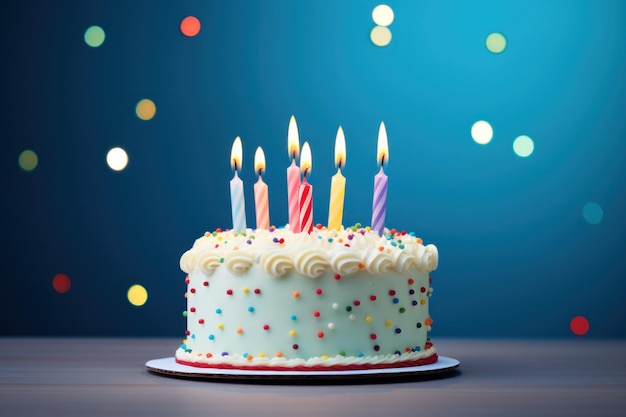
Identify the location of candles. The image size is (626, 417). (239, 197), (249, 199), (295, 193), (305, 197), (337, 197), (386, 187).